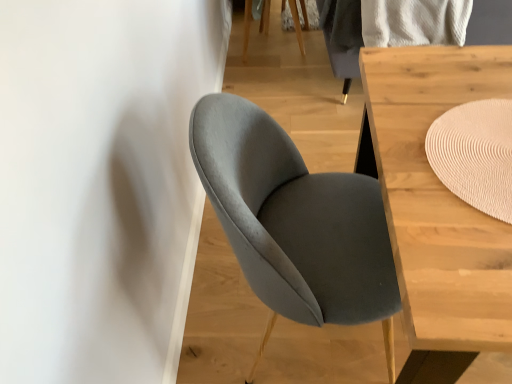
Identify the location of vacant space underneath beige woven mat at upper right (from a real-world perspective). This screenshot has width=512, height=384. (480, 158).